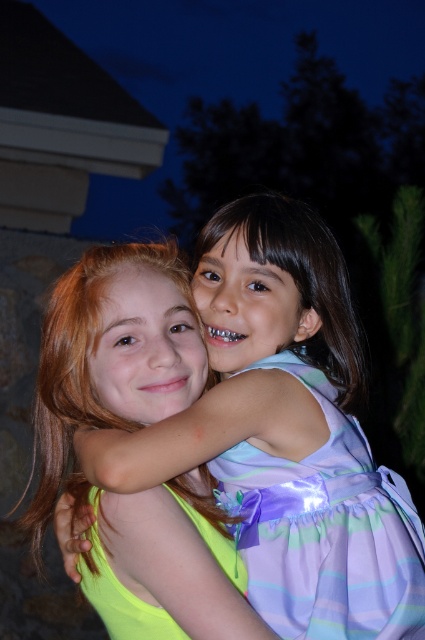
You are a photographer trying to capture the neon green dress at center in your shot. Based on the coordinates provided, where should you position your camera to ensure the dress is centered in the frame?

The neon green dress at center is located at coordinates point (286, 433), so you should position your camera to center the frame at those coordinates to capture the neon green dress at center.

You are a photographer trying to focus on the point at coordinates point (325, 531). Based on the scene description, which object is located at that point?

The point (325, 531) is on the purple satin dress at center.

You are a photographer setting up a camera at eye level. You notice two dresses in the scene, the purple satin dress at center and the neon green satin dress at center. Which dress will appear taller in the photo?

The purple satin dress at center appears taller in the photo because it has a greater height compared to the neon green satin dress at center.